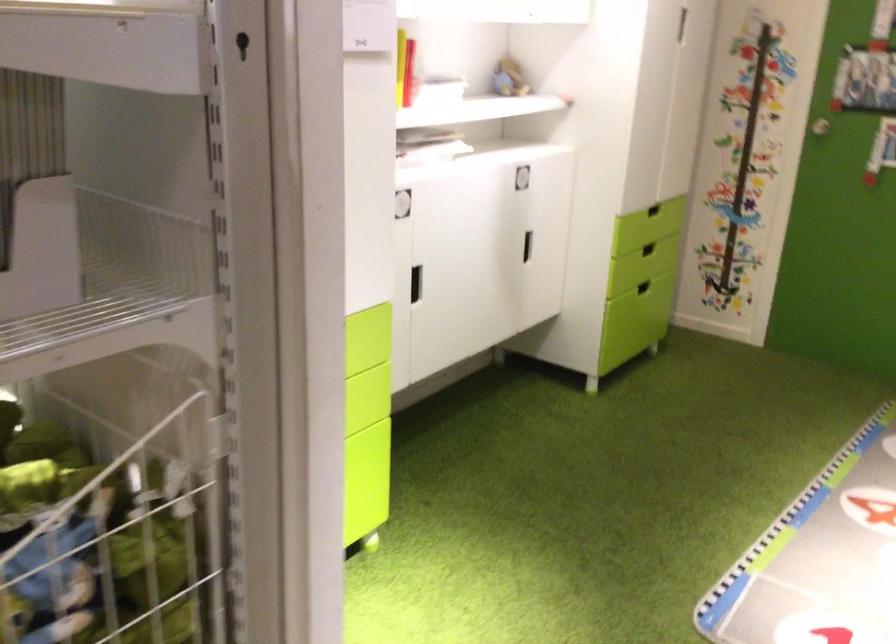
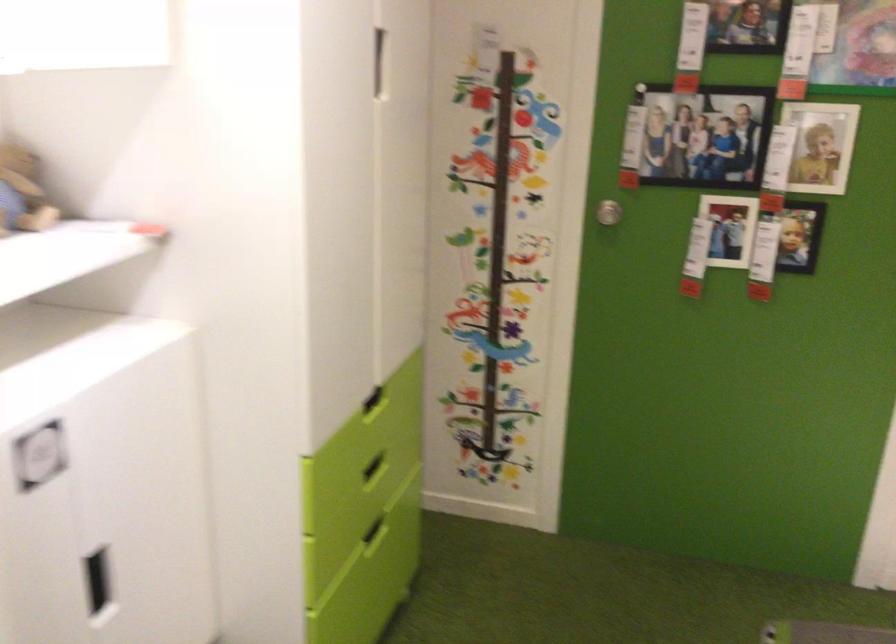
In the second image, find the point that corresponds to pixel 655 242 in the first image.

(374, 468)